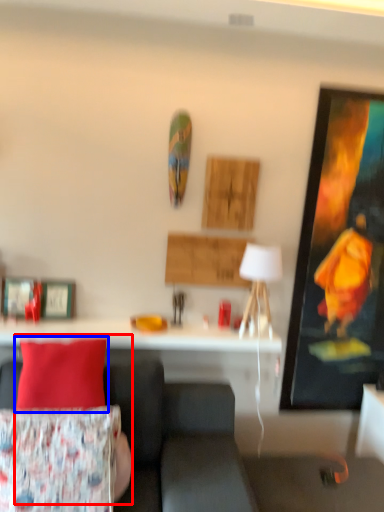
Question: Which point is further to the camera, person (highlighted by a red box) or pillow (highlighted by a blue box)?

Choices:
 (A) person
 (B) pillow

Answer: (B)